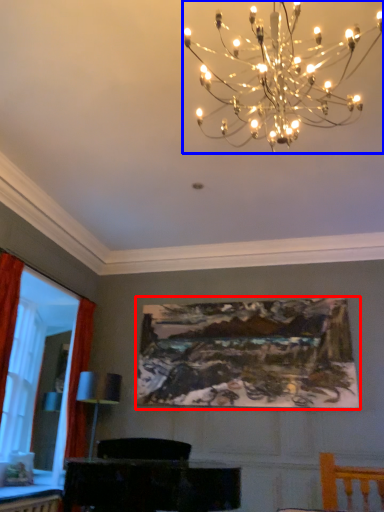
Question: Which object appears closest to the camera in this image, picture frame (highlighted by a red box) or lamp (highlighted by a blue box)?

Choices:
 (A) picture frame
 (B) lamp

Answer: (B)